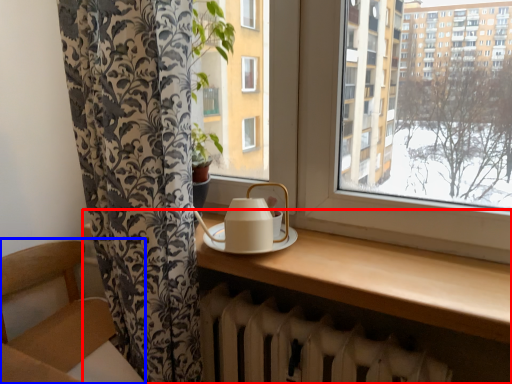
Question: Which point is further to the camera, table (highlighted by a red box) or armchair (highlighted by a blue box)?

Choices:
 (A) table
 (B) armchair

Answer: (B)